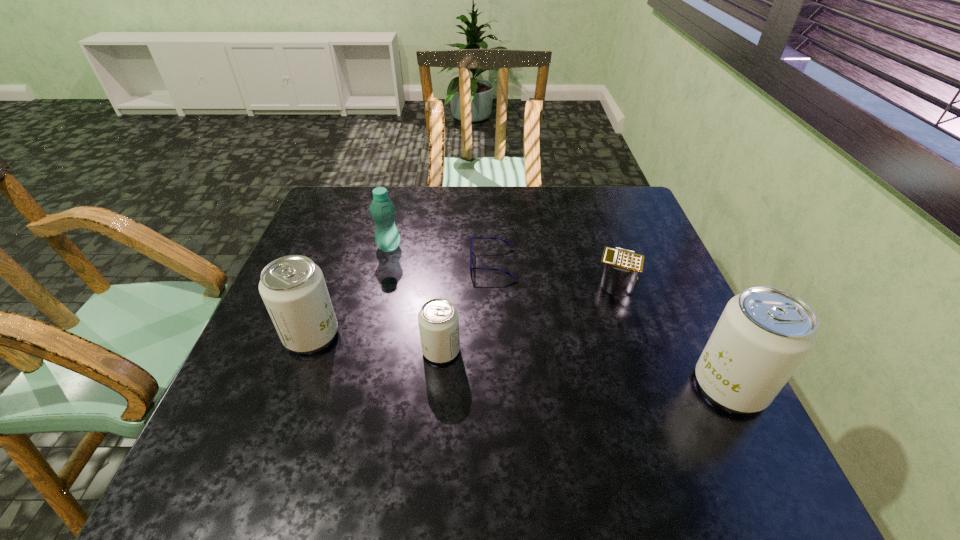
Find the location of a particular element. This screenshot has width=960, height=540. spot to insert another pop_(soda) for uniform distribution is located at coordinates (581, 368).